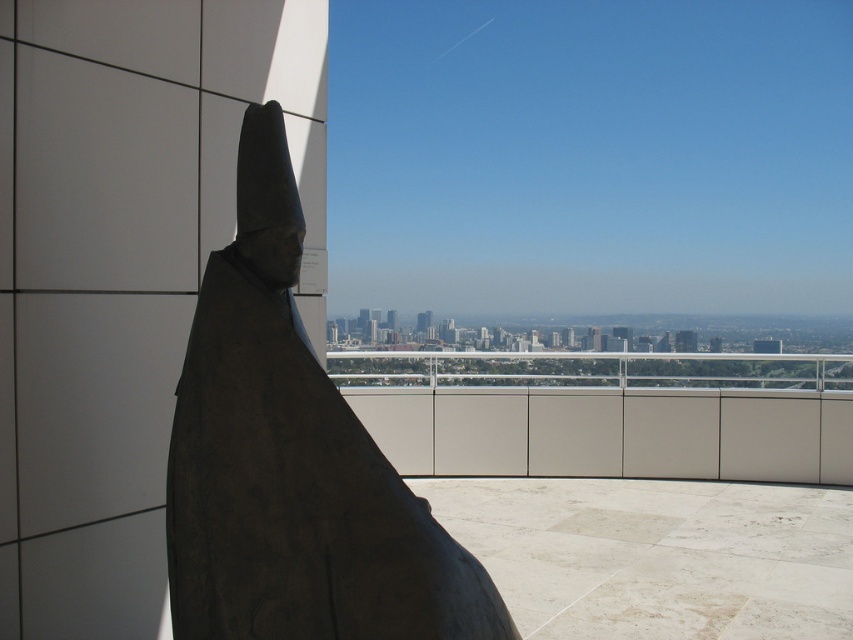
Which is in front, point (320, 416) or point (749, 355)?

Positioned in front is point (320, 416).

Is dark gray stone statue at left shorter than smooth concrete balcony at center?

No.

Is point (393, 611) farther from camera compared to point (646, 445)?

That is False.

This screenshot has width=853, height=640. Find the location of `dark gray stone statue at left`. dark gray stone statue at left is located at coordinates (293, 461).